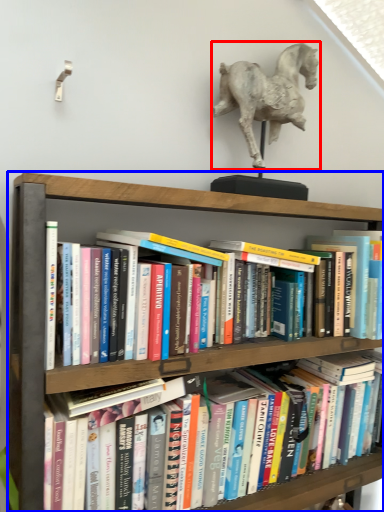
Question: Which object is further to the camera taking this photo, horse (highlighted by a red box) or shelf (highlighted by a blue box)?

Choices:
 (A) horse
 (B) shelf

Answer: (A)